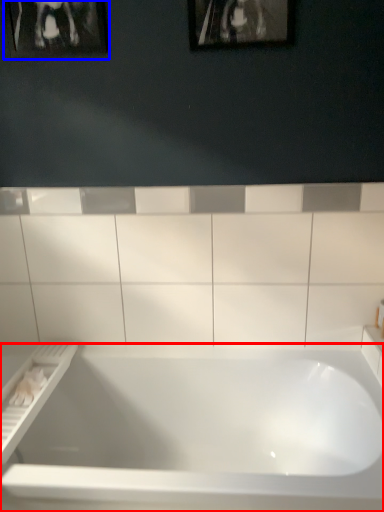
Question: Which of the following is the farthest to the observer, bathtub (highlighted by a red box) or picture frame (highlighted by a blue box)?

Choices:
 (A) bathtub
 (B) picture frame

Answer: (B)